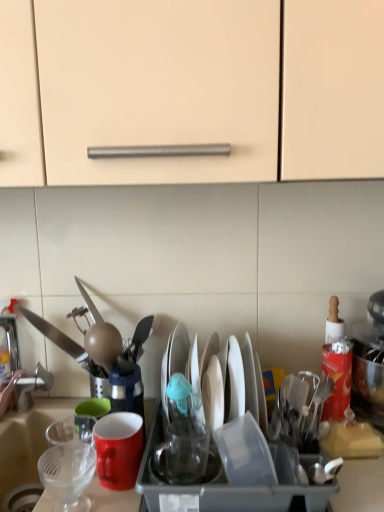
Question: Would you say matte red mug at center is to the left or to the right of transparent plastic cup at center, acting as the 2th tableware starting from the left, in the picture?

Choices:
 (A) left
 (B) right

Answer: (A)

Question: Considering the positions of matte red mug at center and transparent plastic cup at center, which appears as the first tableware when viewed from the right, in the image, is matte red mug at center taller or shorter than transparent plastic cup at center, which appears as the first tableware when viewed from the right,?

Choices:
 (A) tall
 (B) short

Answer: (A)

Question: Considering the real-world distances, which object is farthest from the transparent plastic sink at lower left?

Choices:
 (A) clear plastic strainer at lower left, which is counted as the 1th tableware, starting from the left
 (B) white paper at right
 (C) matte red mug at center
 (D) transparent plastic cup at center, which appears as the first tableware when viewed from the right

Answer: (B)

Question: Which of these objects is positioned closest to the transparent plastic cup at center, which appears as the first tableware when viewed from the right?

Choices:
 (A) white paper at right
 (B) transparent plastic sink at lower left
 (C) matte red mug at center
 (D) clear plastic strainer at lower left, acting as the second tableware starting from the right

Answer: (C)